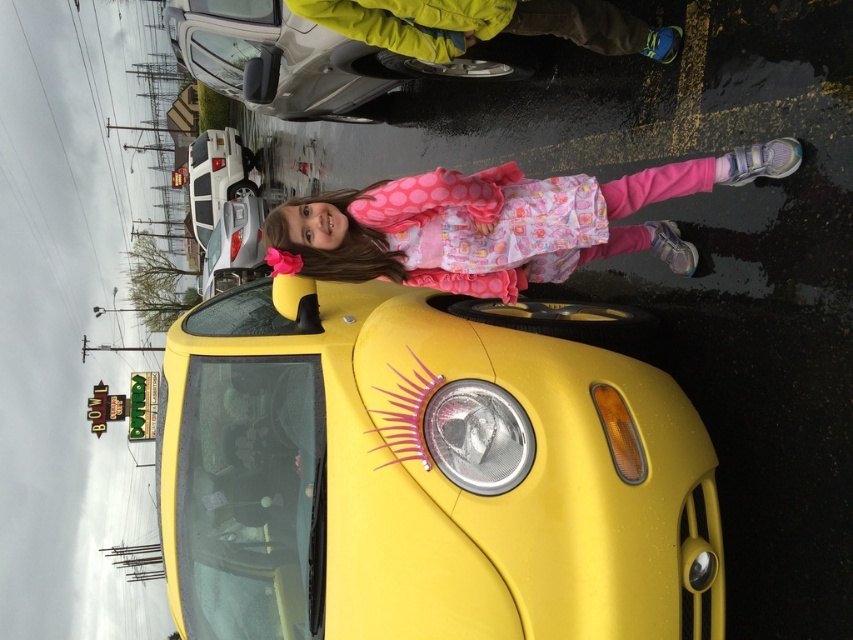
Is metallic silver car at upper center to the right of metallic silver headlight at center from the viewer's perspective?

Incorrect, metallic silver car at upper center is not on the right side of metallic silver headlight at center.

Does metallic silver car at upper center appear under metallic silver headlight at center?

No, metallic silver car at upper center is not below metallic silver headlight at center.

Locate an element on the screen. The height and width of the screenshot is (640, 853). metallic silver car at upper center is located at coordinates (311, 60).

Consider the image. Who is lower down, yellow fabric jacket at upper center or metallic silver headlight at center?

metallic silver headlight at center is below.

Which is more to the right, yellow fabric jacket at upper center or metallic silver headlight at center?

Positioned to the right is yellow fabric jacket at upper center.

Who is more distant from viewer, (578, 10) or (480, 484)?

Positioned behind is point (578, 10).

I want to click on yellow fabric jacket at upper center, so click(486, 24).

Which is behind, point (436, 260) or point (521, 467)?

Point (436, 260)

In the scene shown: Is pink polka dot dress at center further to camera compared to metallic silver headlight at center?

Yes.

Which is in front, point (427, 232) or point (474, 474)?

Point (474, 474)

Find the location of a particular element. This screenshot has width=853, height=640. pink polka dot dress at center is located at coordinates (498, 224).